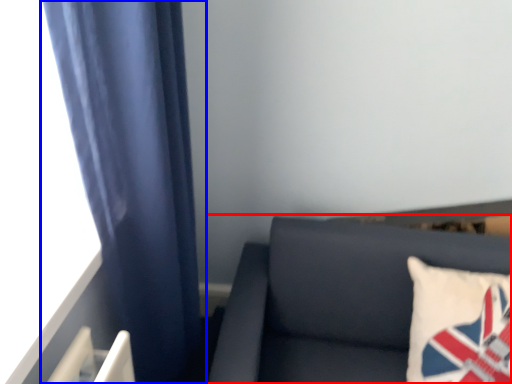
Question: Among these objects, which one is nearest to the camera, furniture (highlighted by a red box) or curtain (highlighted by a blue box)?

Choices:
 (A) furniture
 (B) curtain

Answer: (B)